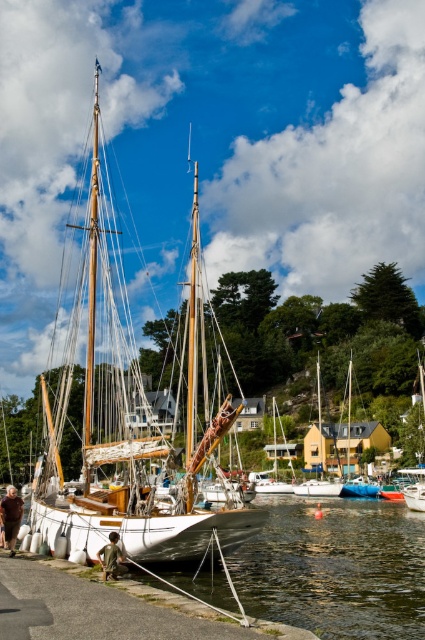
Question: Does white polished wood sailboat at center have a lesser width compared to wooden sailboat at center?

Choices:
 (A) yes
 (B) no

Answer: (B)

Question: Which object is closer to the camera taking this photo?

Choices:
 (A) blue rubber dinghy at center
 (B) white wooden sailboat at center

Answer: (A)

Question: Observing the image, what is the correct spatial positioning of white polished wood sailboat at center in reference to wooden sailboat at center?

Choices:
 (A) below
 (B) above

Answer: (B)

Question: Can you confirm if white polished wood sailboat at center is positioned above wooden sailboat at center?

Choices:
 (A) yes
 (B) no

Answer: (A)

Question: Which object is farther from the camera taking this photo?

Choices:
 (A) wooden sailboat at center
 (B) blue rubber dinghy at center
 (C) white polished wood sailboat at center

Answer: (A)

Question: Which object appears farthest from the camera in this image?

Choices:
 (A) white polished wood sailboat at center
 (B) white wooden sailboat at center
 (C) wooden sailboat at center

Answer: (B)